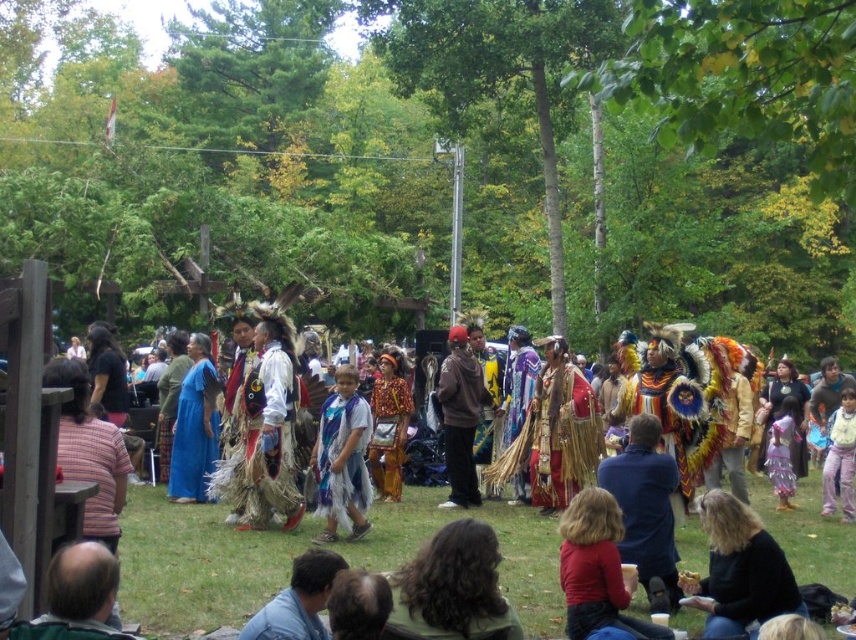
Does black leather jacket at lower right have a lesser width compared to blue feathered headdress at center?

No, black leather jacket at lower right is not thinner than blue feathered headdress at center.

Looking at this image, does black leather jacket at lower right have a lesser height compared to blue feathered headdress at center?

Correct, black leather jacket at lower right is not as tall as blue feathered headdress at center.

Who is more distant from viewer, (762, 616) or (339, 376)?

The point (339, 376) is more distant.

You are a GUI agent. You are given a task and a screenshot of the screen. Output one action in this format:
    pyautogui.click(x=<x>, y=<y>)
    Task: Click on the black leather jacket at lower right
    The width and height of the screenshot is (856, 640).
    Given the screenshot: What is the action you would take?
    pyautogui.click(x=739, y=572)

From the picture: Is shiny metallic headdress at center wider than blue feathered headdress at center?

Yes.

Which is below, shiny metallic headdress at center or blue feathered headdress at center?

Positioned lower is shiny metallic headdress at center.

The image size is (856, 640). Describe the element at coordinates (197, 564) in the screenshot. I see `shiny metallic headdress at center` at that location.

What are the coordinates of `shiny metallic headdress at center` in the screenshot? It's located at tap(197, 564).

Between blue feathered headdress at center and brown suede jacket at center, which one has more height?

Standing taller between the two is brown suede jacket at center.

Is blue feathered headdress at center shorter than brown suede jacket at center?

Yes, blue feathered headdress at center is shorter than brown suede jacket at center.

Does point (367, 493) come in front of point (453, 484)?

Yes, point (367, 493) is in front of point (453, 484).

At what (x,y) coordinates should I click in order to perform the action: click on blue feathered headdress at center. Please return your answer as a coordinate pair (x, y). The height and width of the screenshot is (640, 856). Looking at the image, I should click on (342, 460).